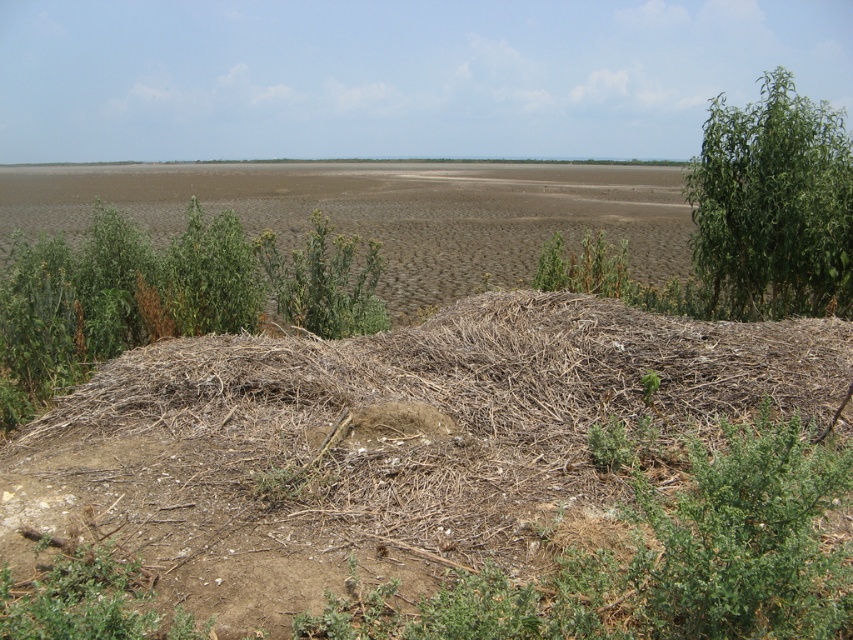
Is point (120, 344) positioned before point (798, 177)?

Yes, it is in front of point (798, 177).

The width and height of the screenshot is (853, 640). In order to click on green leafy plant at left in this screenshot , I will do `click(161, 296)`.

You are a GUI agent. You are given a task and a screenshot of the screen. Output one action in this format:
    pyautogui.click(x=<x>, y=<y>)
    Task: Click on the green leafy plant at left
    The width and height of the screenshot is (853, 640).
    Given the screenshot: What is the action you would take?
    pyautogui.click(x=161, y=296)